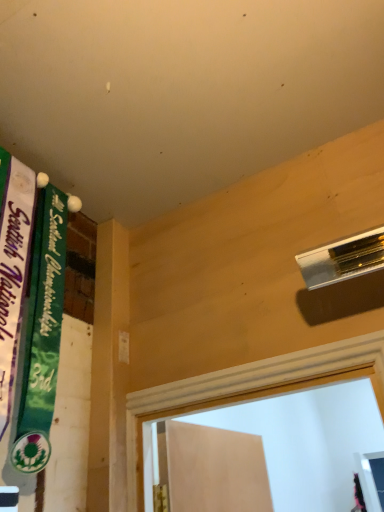
Question: Based on their sizes in the image, would you say green fabric banner at left, placed as the first bulletin board when sorted from left to right, is bigger or smaller than green fabric banner at upper left, placed as the first bulletin board when sorted from right to left?

Choices:
 (A) big
 (B) small

Answer: (A)

Question: Is green fabric banner at left, which appears as the second bulletin board when viewed from the right, taller or shorter than green fabric banner at upper left, placed as the first bulletin board when sorted from right to left?

Choices:
 (A) short
 (B) tall

Answer: (B)

Question: In terms of width, does green fabric banner at left, placed as the first bulletin board when sorted from left to right, look wider or thinner when compared to green fabric banner at upper left, which is counted as the 2th bulletin board, starting from the left?

Choices:
 (A) thin
 (B) wide

Answer: (A)

Question: Based on their sizes in the image, would you say green fabric banner at upper left, which is counted as the 2th bulletin board, starting from the left, is bigger or smaller than green fabric banner at left, placed as the first bulletin board when sorted from left to right?

Choices:
 (A) small
 (B) big

Answer: (A)

Question: Is green fabric banner at upper left, which is counted as the 2th bulletin board, starting from the left, to the left or to the right of green fabric banner at left, placed as the first bulletin board when sorted from left to right, in the image?

Choices:
 (A) left
 (B) right

Answer: (B)

Question: Is point (41, 242) positioned closer to the camera than point (1, 365)?

Choices:
 (A) farther
 (B) closer

Answer: (A)

Question: Is green fabric banner at upper left, placed as the first bulletin board when sorted from right to left, inside the boundaries of green fabric banner at left, which appears as the second bulletin board when viewed from the right, or outside?

Choices:
 (A) outside
 (B) inside

Answer: (A)